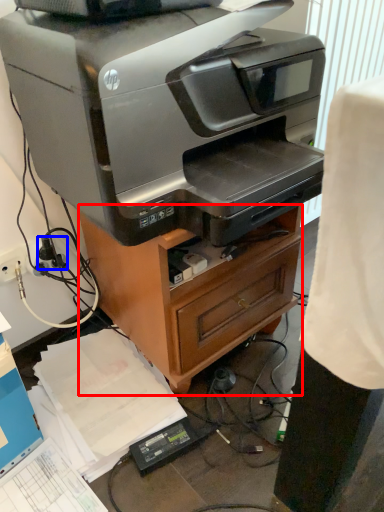
Question: Among these objects, which one is nearest to the camera, furniture (highlighted by a red box) or plug (highlighted by a blue box)?

Choices:
 (A) furniture
 (B) plug

Answer: (A)